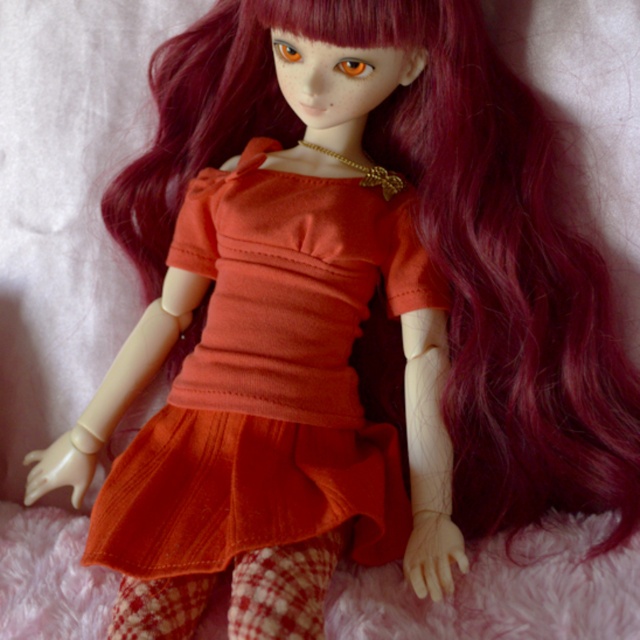
You are a fashion designer who wants to try on the matte orange fabric dress at center. You are standing 1.5 meters away from it. Can you reach the dress without moving closer?

The matte orange fabric dress at center and viewer are 1.16 meters apart. Since you are standing 1.5 meters away, which is farther than the 1.16 meters distance, you cannot reach the dress without moving closer.

You are a fashion designer looking at a doll wearing a matte orange fabric dress at center and a fuzzy pink blanket at lower center. Which item is closer to the viewer?

The matte orange fabric dress at center is closer to the viewer because the fuzzy pink blanket at lower center is behind it.